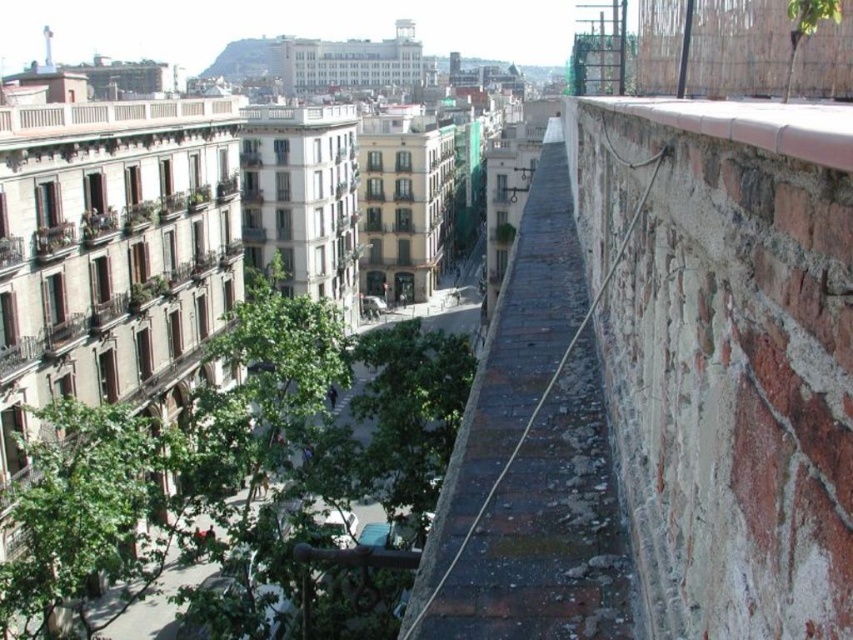
Who is positioned more to the left, green leafy tree at center or smooth concrete ledge at upper right?

Positioned to the left is green leafy tree at center.

Measure the distance between point (x=367, y=353) and camera.

The distance of point (x=367, y=353) from camera is 195.77 feet.

In order to click on green leafy tree at center in this screenshot , I will do `click(234, 456)`.

Is brick wall at right smaller than smooth concrete ledge at upper right?

Incorrect, brick wall at right is not smaller in size than smooth concrete ledge at upper right.

Between brick wall at right and smooth concrete ledge at upper right, which one is positioned lower?

smooth concrete ledge at upper right

Does point (451, 518) come closer to viewer compared to point (842, 150)?

No, (451, 518) is further to viewer.

Image resolution: width=853 pixels, height=640 pixels. Find the location of `brick wall at right`. brick wall at right is located at coordinates (531, 458).

In the scene shown: Is green leafy tree at center positioned before brick wall at right?

No, it is behind brick wall at right.

Is green leafy tree at center positioned at the back of brick wall at right?

Yes.

What are the coordinates of `green leafy tree at center` in the screenshot? It's located at (234, 456).